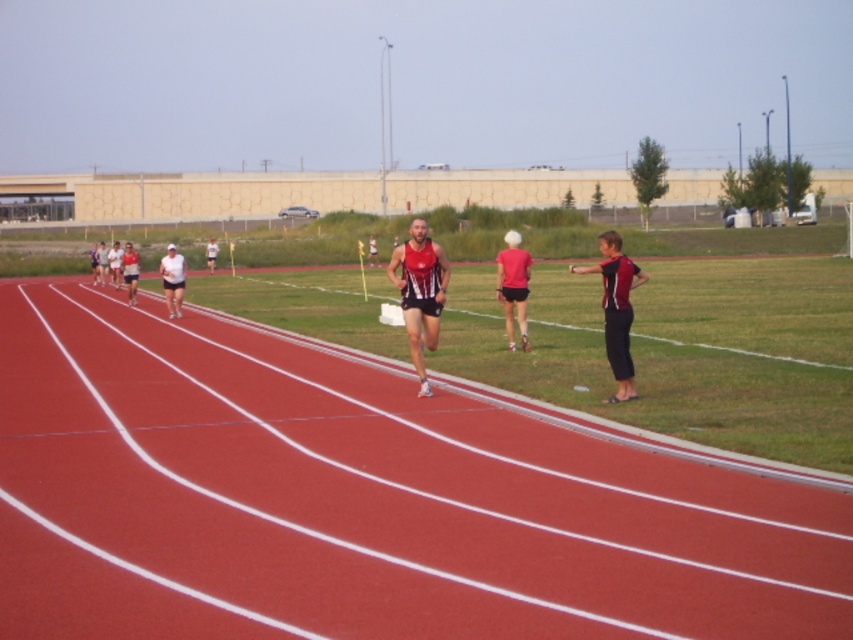
Question: Which object is the farthest from the matte red and black uniform at right?

Choices:
 (A) matte pink shirt at center
 (B) rubberized red track at center

Answer: (B)

Question: Which is nearer to the matte red running suit at center?

Choices:
 (A) white matte shirt at center
 (B) matte white shirt at left
 (C) matte white shirt at center

Answer: (A)

Question: Does white matte shirt at center have a smaller size compared to matte white shirt at left?

Choices:
 (A) yes
 (B) no

Answer: (B)

Question: Considering the relative positions of rubberized red track at center and white matte shirt at center in the image provided, where is rubberized red track at center located with respect to white matte shirt at center?

Choices:
 (A) right
 (B) left

Answer: (A)

Question: Estimate the real-world distances between objects in this image. Which object is farther from the matte red running suit at center?

Choices:
 (A) matte red and black uniform at right
 (B) rubberized red track at center
 (C) matte pink shirt at center

Answer: (C)

Question: Can you confirm if matte red running suit at center is positioned above matte white shirt at center?

Choices:
 (A) no
 (B) yes

Answer: (A)